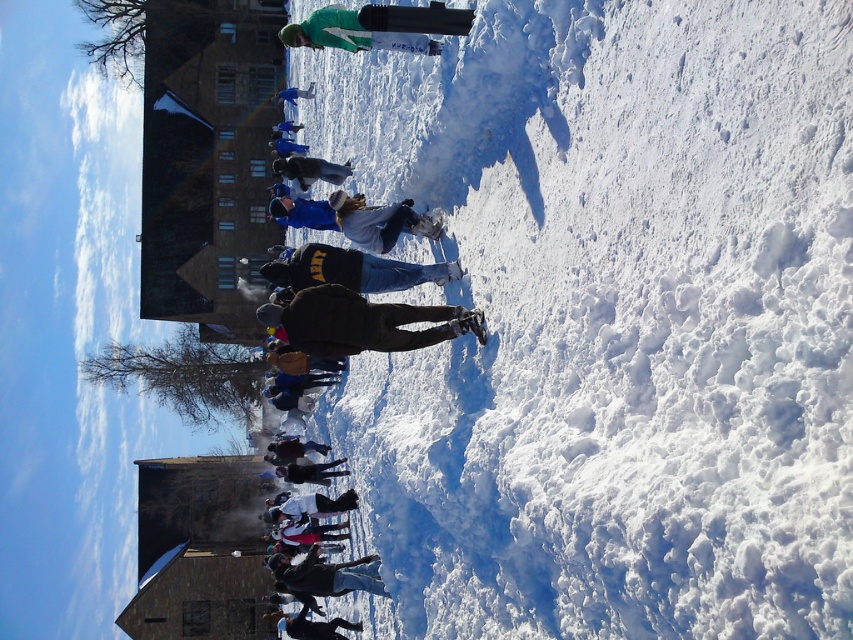
Question: Which of the following is the farthest from the observer?

Choices:
 (A) blue fabric jacket at center
 (B) matte blue jacket at center

Answer: (B)

Question: Can you confirm if dark brown jacket at center is bigger than matte blue jacket at center?

Choices:
 (A) yes
 (B) no

Answer: (B)

Question: Considering the real-world distances, which object is farthest from the dark brown jacket at center?

Choices:
 (A) blue fabric jacket at center
 (B) matte blue jacket at center

Answer: (B)

Question: Is dark brown jacket at center smaller than matte blue jacket at center?

Choices:
 (A) no
 (B) yes

Answer: (B)

Question: In this image, where is dark brown jacket at center located relative to matte blue jacket at center?

Choices:
 (A) above
 (B) below

Answer: (B)

Question: Which of the following is the closest to the observer?

Choices:
 (A) dark brown jacket at center
 (B) matte blue jacket at center

Answer: (A)